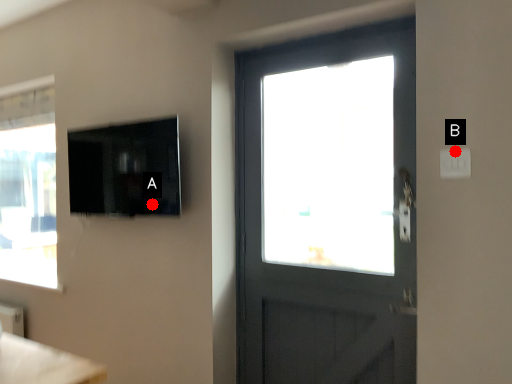
Question: Two points are circled on the image, labeled by A and B beside each circle. Which point is farther from the camera taking this photo?

Choices:
 (A) A is further
 (B) B is further

Answer: (A)